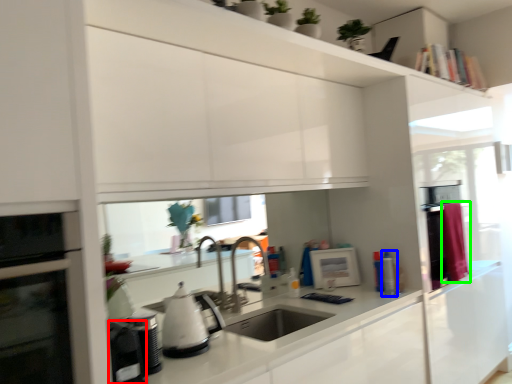
Question: Which object is positioned farthest from appliance (highlighted by a red box)? Select from appliance (highlighted by a blue box) and curtain (highlighted by a green box).

Choices:
 (A) appliance
 (B) curtain

Answer: (B)